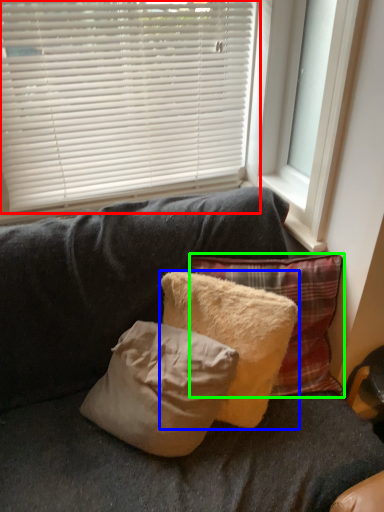
Question: Which object is positioned closest to window blind (highlighted by a red box)? Select from pillow (highlighted by a blue box) and pillow (highlighted by a green box).

Choices:
 (A) pillow
 (B) pillow

Answer: (B)